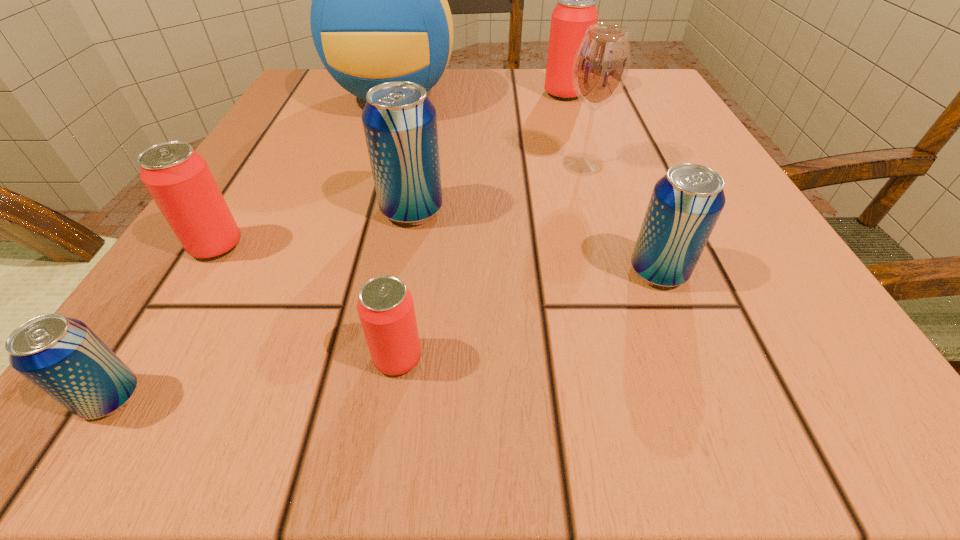
Identify the location of the tallest object. (379, 13).

Find the location of `blue volleyball`. blue volleyball is located at coordinates (379, 13).

You are a GUI agent. You are given a task and a screenshot of the screen. Output one action in this format:
    pyautogui.click(x=<x>, y=<y>)
    Task: Click on the red wineglass
    The image size is (960, 540).
    Given the screenshot: What is the action you would take?
    pyautogui.click(x=601, y=64)

Locate an element on the screen. wineglass is located at coordinates (601, 64).

Find the location of a particular element. The image size is (960, 540). the farthest beer can is located at coordinates (576, 10).

Locate an element on the screen. Image resolution: width=960 pixels, height=540 pixels. the biggest red beer can is located at coordinates [x=576, y=10].

At what (x,y) coordinates should I click in order to perform the action: click on the second blue beer can from right to left. Please return your answer as a coordinate pair (x, y). The image size is (960, 540). Looking at the image, I should click on (400, 123).

Identify the location of the farthest blue beer can. (400, 123).

Locate an element on the screen. the second smallest blue beer can is located at coordinates (685, 204).

Where is `the rightmost blue beer can`? the rightmost blue beer can is located at coordinates (685, 204).